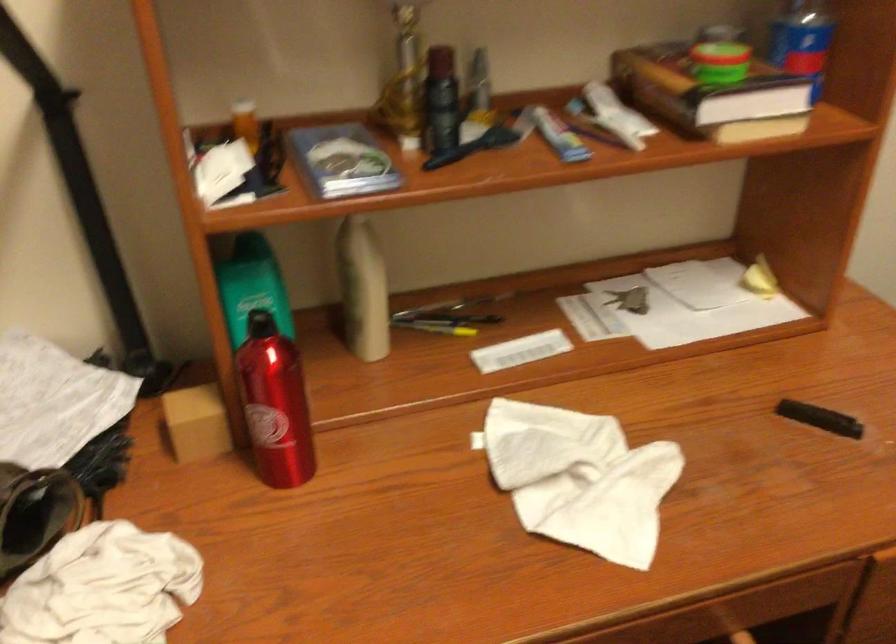
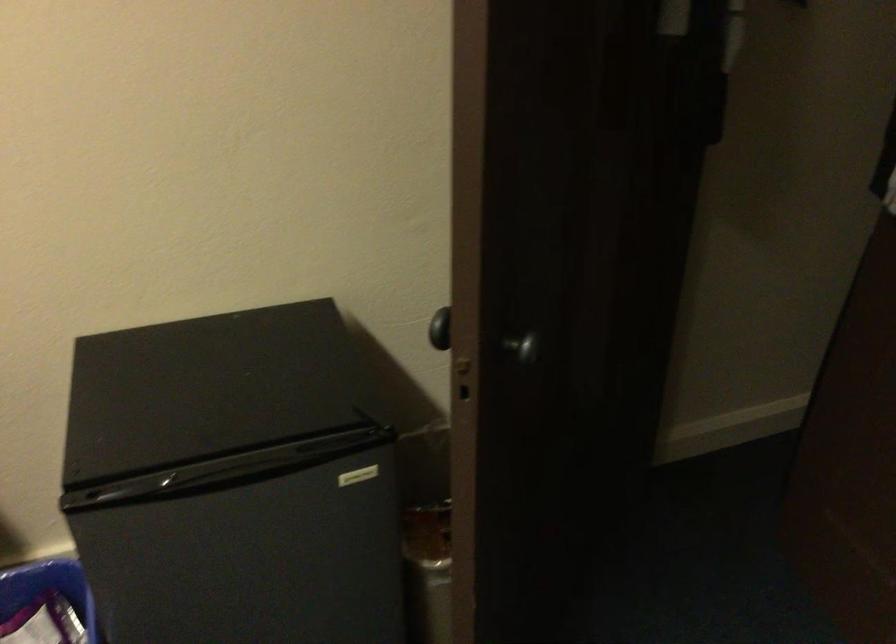
Question: The images are taken continuously from a first-person perspective. In which direction are you moving?

Choices:
 (A) Left
 (B) Right
 (C) Forward
 (D) Backward

Answer: (B)